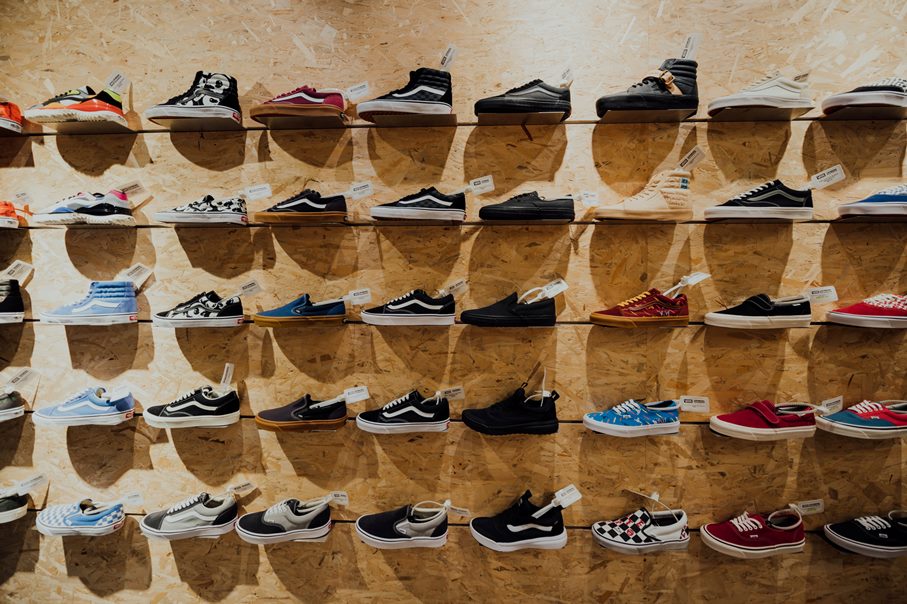
You are a GUI agent. You are given a task and a screenshot of the screen. Output one action in this format:
    pyautogui.click(x=<x>, y=<y>)
    Task: Click on the shoes on bottom shelf
    
    Given the screenshot: What is the action you would take?
    pyautogui.click(x=15, y=509), pyautogui.click(x=81, y=513), pyautogui.click(x=180, y=516), pyautogui.click(x=299, y=518), pyautogui.click(x=522, y=527), pyautogui.click(x=407, y=535), pyautogui.click(x=635, y=530), pyautogui.click(x=743, y=527), pyautogui.click(x=868, y=535)